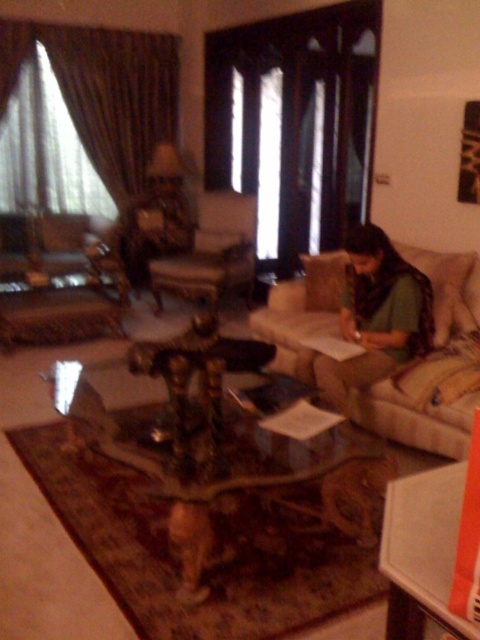
Does beige fabric couch at center have a greater height compared to green fabric person at right?

Indeed, beige fabric couch at center has a greater height compared to green fabric person at right.

Can you confirm if beige fabric couch at center is positioned below green fabric person at right?

Incorrect, beige fabric couch at center is not positioned below green fabric person at right.

Image resolution: width=480 pixels, height=640 pixels. Describe the element at coordinates (430, 364) in the screenshot. I see `beige fabric couch at center` at that location.

The width and height of the screenshot is (480, 640). Identify the location of beige fabric couch at center. (430, 364).

Is transparent glass table at center wider than green fabric person at right?

Correct, the width of transparent glass table at center exceeds that of green fabric person at right.

Can you confirm if transparent glass table at center is positioned to the left of green fabric person at right?

Yes, transparent glass table at center is to the left of green fabric person at right.

The image size is (480, 640). What do you see at coordinates (216, 460) in the screenshot?
I see `transparent glass table at center` at bounding box center [216, 460].

Where is `transparent glass table at center`? This screenshot has width=480, height=640. transparent glass table at center is located at coordinates (216, 460).

Does transparent glass table at center lie in front of beige fabric couch at center?

Yes, transparent glass table at center is closer to the viewer.

This screenshot has width=480, height=640. What do you see at coordinates (216, 460) in the screenshot?
I see `transparent glass table at center` at bounding box center [216, 460].

Is point (163, 492) more distant than point (463, 419)?

No, it is not.

At what (x,y) coordinates should I click in order to perform the action: click on transparent glass table at center. Please return your answer as a coordinate pair (x, y). Looking at the image, I should click on (216, 460).